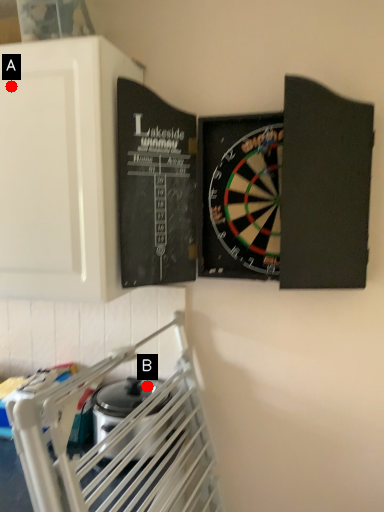
Question: Two points are circled on the image, labeled by A and B beside each circle. Which of the following is the closest to the observer?

Choices:
 (A) A is closer
 (B) B is closer

Answer: (A)